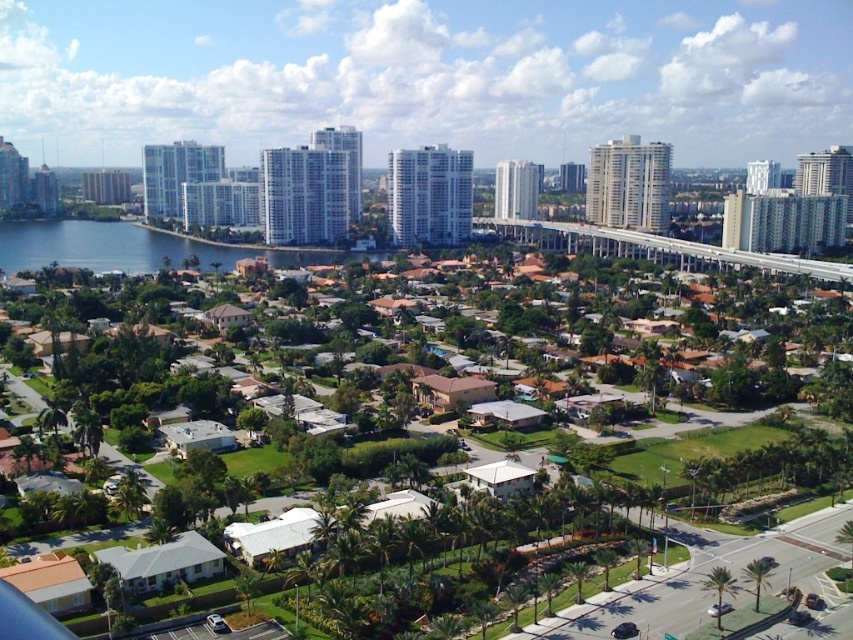
You are standing at the point with coordinates point [349,570] and want to move towards point [166,248]. Given that both points are in the same image, which direction should you move to reach your destination?

Since point [349,570] is closer to the viewer than point [166,248], you should move forward to reach point [166,248].

You are standing at the edge of the blue water at lower left and want to walk towards the green grass at center. Which direction should you head?

You should head to the right, as the green grass at center is located to the right of the blue water at lower left.